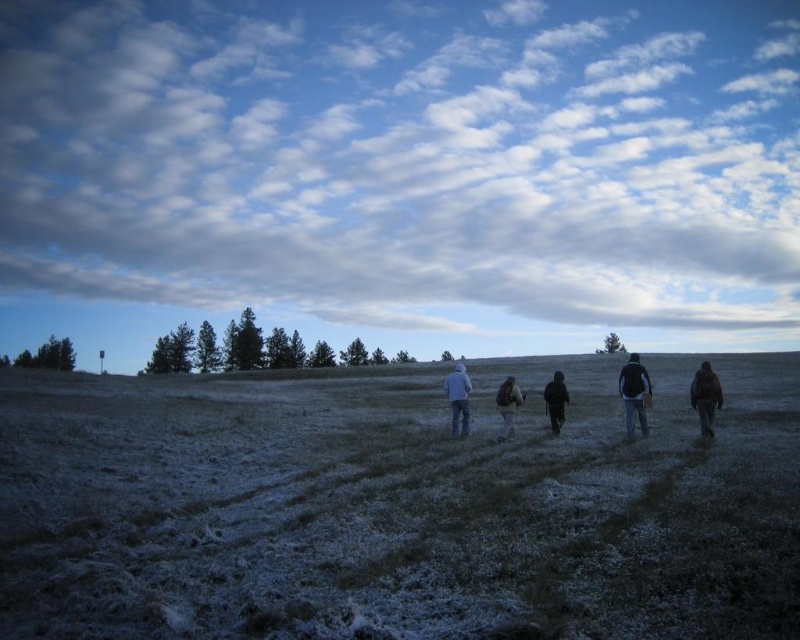
Question: In this image, where is blue denim jeans at center located relative to black matte jacket at center?

Choices:
 (A) right
 (B) left

Answer: (B)

Question: Which object is the closest to the brown fuzzy jacket at right?

Choices:
 (A) blue denim jeans at center
 (B) dark brown backpack at center
 (C) cloudy sky at upper center
 (D) black matte jacket at center

Answer: (D)

Question: Which object appears farthest from the camera in this image?

Choices:
 (A) blue denim jeans at center
 (B) frosted grass at center
 (C) brown fuzzy jacket at right

Answer: (A)

Question: Is the position of cloudy sky at upper center more distant than that of black matte jacket at right?

Choices:
 (A) no
 (B) yes

Answer: (B)

Question: Can you confirm if black matte jacket at right is positioned below black matte jacket at center?

Choices:
 (A) yes
 (B) no

Answer: (B)

Question: Which object is positioned farthest from the dark brown backpack at center?

Choices:
 (A) black matte jacket at center
 (B) black matte jacket at right

Answer: (B)